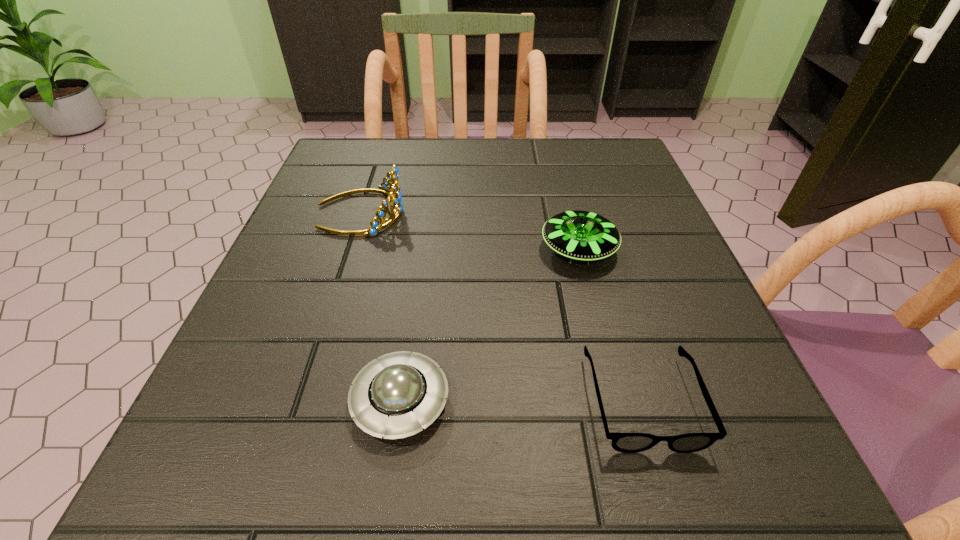
In the image, there is a desktop. Find the location of `vacant region at the right edge`. vacant region at the right edge is located at coordinates (719, 357).

Where is `free space at the far left corner of the desktop`? The width and height of the screenshot is (960, 540). free space at the far left corner of the desktop is located at coordinates (345, 183).

Locate an element on the screen. The image size is (960, 540). free space at the far right corner of the desktop is located at coordinates (578, 159).

You are a GUI agent. You are given a task and a screenshot of the screen. Output one action in this format:
    pyautogui.click(x=<x>, y=<y>)
    Task: Click on the empty space that is in between the farther saucer and the spectacles
    The image size is (960, 540).
    Given the screenshot: What is the action you would take?
    pyautogui.click(x=610, y=325)

What are the coordinates of `free spot between the right saucer and the tiara` in the screenshot? It's located at (469, 231).

Find the location of a particular element. free spot between the tallest object and the right saucer is located at coordinates [469, 231].

Identify the location of free space between the tiara and the second shortest object. (380, 306).

At what (x,y) coordinates should I click in order to perform the action: click on vacant area that lies between the tallest object and the second shortest object. Please return your answer as a coordinate pair (x, y). This screenshot has width=960, height=540. Looking at the image, I should click on (380, 306).

Where is `empty location between the spectacles and the nearer saucer`? The width and height of the screenshot is (960, 540). empty location between the spectacles and the nearer saucer is located at coordinates (521, 401).

Where is `blank region between the shortest object and the taller saucer`? This screenshot has width=960, height=540. blank region between the shortest object and the taller saucer is located at coordinates (610, 325).